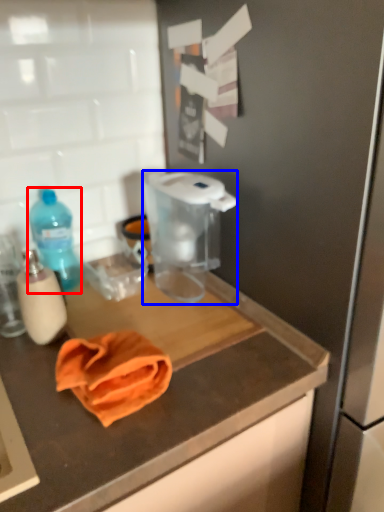
Question: Which object appears farthest to the camera in this image, bottle (highlighted by a red box) or appliance (highlighted by a blue box)?

Choices:
 (A) bottle
 (B) appliance

Answer: (A)